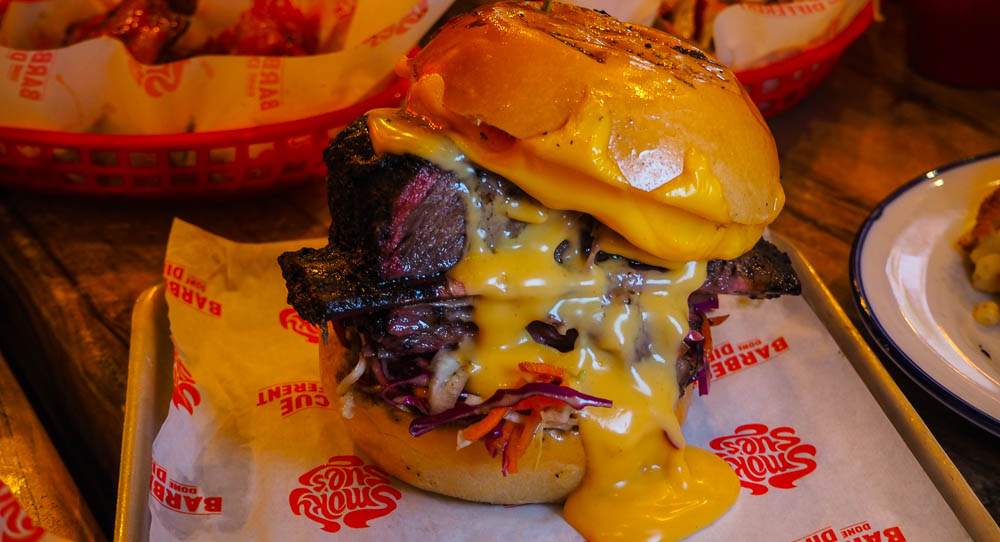
At what (x,y) coordinates should I click in order to perform the action: click on basket. Please return your answer as a coordinate pair (x, y). The image size is (1000, 542). Looking at the image, I should click on (258, 154), (809, 57).